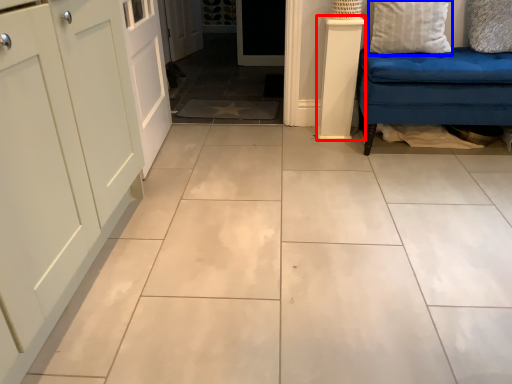
Question: Which object appears farthest to the camera in this image, pillar (highlighted by a red box) or pillow (highlighted by a blue box)?

Choices:
 (A) pillar
 (B) pillow

Answer: (A)